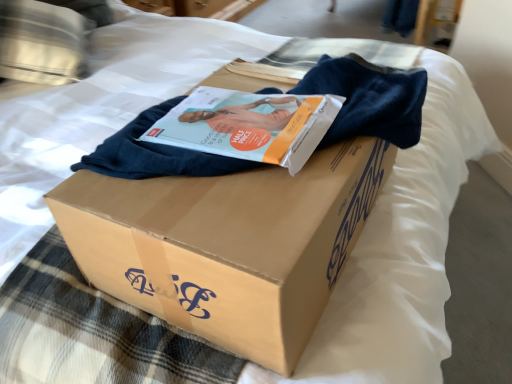
Question: Is matte paper magazine at center behind brown cardboard box at center?

Choices:
 (A) no
 (B) yes

Answer: (B)

Question: Is matte paper magazine at center thinner than brown cardboard box at center?

Choices:
 (A) yes
 (B) no

Answer: (A)

Question: Does matte paper magazine at center have a lesser height compared to brown cardboard box at center?

Choices:
 (A) yes
 (B) no

Answer: (A)

Question: Is matte paper magazine at center at the left side of brown cardboard box at center?

Choices:
 (A) yes
 (B) no

Answer: (A)

Question: From a real-world perspective, is matte paper magazine at center over brown cardboard box at center?

Choices:
 (A) no
 (B) yes

Answer: (B)

Question: From the image's perspective, relative to metallic silver pillow at upper left, is matte paper magazine at center above or below?

Choices:
 (A) below
 (B) above

Answer: (A)

Question: Is matte paper magazine at center to the left or to the right of metallic silver pillow at upper left in the image?

Choices:
 (A) left
 (B) right

Answer: (B)

Question: Which is correct: matte paper magazine at center is inside metallic silver pillow at upper left, or outside of it?

Choices:
 (A) inside
 (B) outside

Answer: (B)

Question: In terms of height, does matte paper magazine at center look taller or shorter compared to metallic silver pillow at upper left?

Choices:
 (A) tall
 (B) short

Answer: (B)

Question: Is metallic silver pillow at upper left wider or thinner than brown cardboard box at center?

Choices:
 (A) thin
 (B) wide

Answer: (B)

Question: Relative to brown cardboard box at center, is metallic silver pillow at upper left in front or behind?

Choices:
 (A) behind
 (B) front

Answer: (A)

Question: From the image's perspective, is metallic silver pillow at upper left above or below brown cardboard box at center?

Choices:
 (A) below
 (B) above

Answer: (B)

Question: Do you think metallic silver pillow at upper left is within brown cardboard box at center, or outside of it?

Choices:
 (A) inside
 (B) outside

Answer: (B)

Question: Is brown cardboard box at center in front of or behind matte paper magazine at center in the image?

Choices:
 (A) front
 (B) behind

Answer: (A)

Question: Based on their sizes in the image, would you say brown cardboard box at center is bigger or smaller than matte paper magazine at center?

Choices:
 (A) big
 (B) small

Answer: (A)